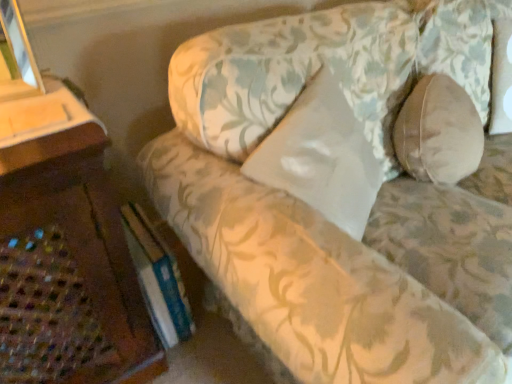
Question: From the image's perspective, would you say floral fabric couch at center is shown under white satin pillow at center, acting as the first pillow starting from the left?

Choices:
 (A) yes
 (B) no

Answer: (B)

Question: Is floral fabric couch at center positioned far away from white satin pillow at center, acting as the first pillow starting from the left?

Choices:
 (A) no
 (B) yes

Answer: (A)

Question: Can you confirm if floral fabric couch at center is positioned to the left of white satin pillow at center, which is the second pillow in right-to-left order?

Choices:
 (A) no
 (B) yes

Answer: (A)

Question: Is floral fabric couch at center at the right side of white satin pillow at center, which is the second pillow in right-to-left order?

Choices:
 (A) yes
 (B) no

Answer: (A)

Question: From a real-world perspective, is floral fabric couch at center under white satin pillow at center, which is the second pillow in right-to-left order?

Choices:
 (A) yes
 (B) no

Answer: (A)

Question: Can you confirm if floral fabric couch at center is taller than white satin pillow at center, which is the second pillow in right-to-left order?

Choices:
 (A) no
 (B) yes

Answer: (B)

Question: Can you confirm if floral fabric couch at center is wider than beige fabric pillow at right, the second pillow from the left?

Choices:
 (A) no
 (B) yes

Answer: (B)

Question: Does floral fabric couch at center turn towards beige fabric pillow at right, the second pillow from the left?

Choices:
 (A) yes
 (B) no

Answer: (A)

Question: Is floral fabric couch at center turned away from beige fabric pillow at right, the first pillow positioned from the right?

Choices:
 (A) yes
 (B) no

Answer: (A)

Question: Is floral fabric couch at center at the right side of beige fabric pillow at right, the second pillow from the left?

Choices:
 (A) yes
 (B) no

Answer: (B)

Question: From the image's perspective, is floral fabric couch at center on top of beige fabric pillow at right, the second pillow from the left?

Choices:
 (A) yes
 (B) no

Answer: (B)

Question: Is floral fabric couch at center outside beige fabric pillow at right, the first pillow positioned from the right?

Choices:
 (A) yes
 (B) no

Answer: (A)

Question: Considering the relative sizes of white satin pillow at center, which is the second pillow in right-to-left order, and floral fabric couch at center in the image provided, is white satin pillow at center, which is the second pillow in right-to-left order, thinner than floral fabric couch at center?

Choices:
 (A) no
 (B) yes

Answer: (B)